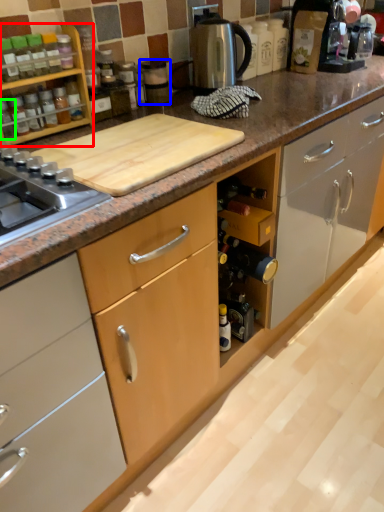
Question: Which object is the farthest from kitchen appliance (highlighted by a red box)? Choose among these: appliance (highlighted by a blue box) or bottle (highlighted by a green box).

Choices:
 (A) appliance
 (B) bottle

Answer: (A)